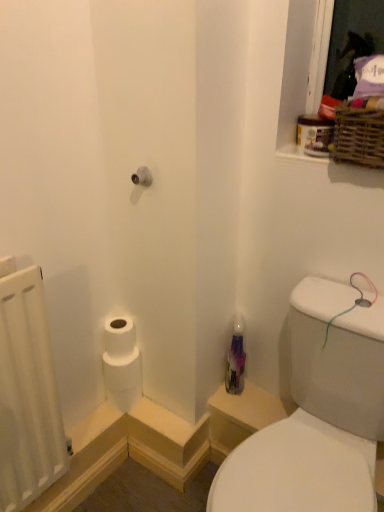
Where is `transparent plastic bottle at lower right`? Image resolution: width=384 pixels, height=512 pixels. transparent plastic bottle at lower right is located at coordinates (317, 415).

You are a GUI agent. You are given a task and a screenshot of the screen. Output one action in this format:
    pyautogui.click(x=<x>, y=<y>)
    Task: Click on the white matte radiator at left
    
    Given the screenshot: What is the action you would take?
    pyautogui.click(x=27, y=394)

Describe the element at coordinates (359, 134) in the screenshot. The image size is (384, 512). I see `woven brown basket at upper right` at that location.

This screenshot has width=384, height=512. Identify the location of transparent plastic bottle at lower right. (317, 415).

I want to click on radiator that is in front of the woven brown basket at upper right, so [x=27, y=394].

Does woven brown basket at upper right touch white matte radiator at left?

woven brown basket at upper right is not next to white matte radiator at left, and they're not touching.

Could you tell me if woven brown basket at upper right is facing white matte radiator at left?

No, woven brown basket at upper right is not turned towards white matte radiator at left.

From a real-world perspective, which object stands above the other?

woven brown basket at upper right, from a real-world perspective.

From the image's perspective, which one is positioned lower, woven brown basket at upper right or white matte toilet paper at lower left?

From the image's view, white matte toilet paper at lower left is below.

Is woven brown basket at upper right further to the viewer compared to white matte toilet paper at lower left?

No.

Which of these two, woven brown basket at upper right or white matte toilet paper at lower left, stands taller?

Standing taller between the two is white matte toilet paper at lower left.

Consider the image. Is woven brown basket at upper right spatially inside white matte toilet paper at lower left, or outside of it?

woven brown basket at upper right is spatially situated outside white matte toilet paper at lower left.

Which of these two, translucent purple bottle at center or white matte radiator at left, is bigger?

Bigger between the two is white matte radiator at left.

Between translucent purple bottle at center and white matte radiator at left, which one has less height?

translucent purple bottle at center is shorter.

Identify the location of toiletry on the right of white matte radiator at left. (236, 359).

Is white matte toilet paper at lower left further to camera compared to transparent plastic bottle at lower right?

Yes, white matte toilet paper at lower left is further from the viewer.

Is transparent plastic bottle at lower right completely or partially inside white matte toilet paper at lower left?

That's incorrect, transparent plastic bottle at lower right is not inside white matte toilet paper at lower left.

Between white matte toilet paper at lower left and transparent plastic bottle at lower right, which one appears on the right side from the viewer's perspective?

From the viewer's perspective, transparent plastic bottle at lower right appears more on the right side.

Is white matte toilet paper at lower left far away from transparent plastic bottle at lower right?

No.

Is transparent plastic bottle at lower right positioned far away from translucent purple bottle at center?

transparent plastic bottle at lower right is actually quite close to translucent purple bottle at center.

Is transparent plastic bottle at lower right situated inside translucent purple bottle at center or outside?

transparent plastic bottle at lower right is outside translucent purple bottle at center.

Is point (303, 294) more distant than point (231, 369)?

No, it is in front of (231, 369).

Locate an element on the screen. sink in front of the translucent purple bottle at center is located at coordinates (x=317, y=415).

Consider the image. Is transparent plastic bottle at lower right bigger than white matte toilet paper at lower left?

Indeed, transparent plastic bottle at lower right has a larger size compared to white matte toilet paper at lower left.

Does transparent plastic bottle at lower right have a lesser width compared to white matte toilet paper at lower left?

Incorrect, the width of transparent plastic bottle at lower right is not less than that of white matte toilet paper at lower left.

From the image's perspective, who appears lower, transparent plastic bottle at lower right or white matte toilet paper at lower left?

transparent plastic bottle at lower right.

What's the angular difference between white matte toilet paper at lower left and translucent purple bottle at center's facing directions?

The angular difference between white matte toilet paper at lower left and translucent purple bottle at center is 89.5 degrees.

How much distance is there between white matte toilet paper at lower left and translucent purple bottle at center?

white matte toilet paper at lower left and translucent purple bottle at center are 13.90 inches apart from each other.

Considering the positions of objects white matte toilet paper at lower left and translucent purple bottle at center in the image provided, who is behind, white matte toilet paper at lower left or translucent purple bottle at center?

white matte toilet paper at lower left is more distant.

From the image's perspective, is white matte toilet paper at lower left over translucent purple bottle at center?

Actually, white matte toilet paper at lower left appears below translucent purple bottle at center in the image.

Image resolution: width=384 pixels, height=512 pixels. I want to click on basket above the white matte radiator at left (from the image's perspective), so click(x=359, y=134).

The height and width of the screenshot is (512, 384). I want to click on toilet paper lying behind the woven brown basket at upper right, so click(x=123, y=379).

Considering their positions, is translucent purple bottle at center positioned closer to woven brown basket at upper right than transparent plastic bottle at lower right?

Among the two, transparent plastic bottle at lower right is located nearer to woven brown basket at upper right.

Estimate the real-world distances between objects in this image. Which object is further from white matte radiator at left, white matte toilet paper at lower left or woven brown basket at upper right?

woven brown basket at upper right lies further to white matte radiator at left than the other object.

Looking at the image, which one is located further to white matte radiator at left, woven brown basket at upper right or transparent plastic bottle at lower right?

woven brown basket at upper right is positioned further to the anchor white matte radiator at left.

From the image, which object appears to be farther from translucent purple bottle at center, white matte radiator at left or woven brown basket at upper right?

woven brown basket at upper right.

From the image, which object appears to be farther from white matte radiator at left, transparent plastic bottle at lower right or translucent purple bottle at center?

translucent purple bottle at center.

Considering their positions, is transparent plastic bottle at lower right positioned further to woven brown basket at upper right than white matte radiator at left?

white matte radiator at left lies further to woven brown basket at upper right than the other object.

Based on their spatial positions, is transparent plastic bottle at lower right or white matte toilet paper at lower left closer to translucent purple bottle at center?

Result: white matte toilet paper at lower left is closer to translucent purple bottle at center.

Which object lies nearer to the anchor point woven brown basket at upper right, transparent plastic bottle at lower right or translucent purple bottle at center?

transparent plastic bottle at lower right lies closer to woven brown basket at upper right than the other object.

I want to click on toiletry between woven brown basket at upper right and white matte toilet paper at lower left in the vertical direction, so click(x=236, y=359).

At what (x,y) coordinates should I click in order to perform the action: click on radiator between transparent plastic bottle at lower right and translucent purple bottle at center in the front-back direction. Please return your answer as a coordinate pair (x, y). The width and height of the screenshot is (384, 512). Looking at the image, I should click on (27, 394).

Locate an element on the screen. radiator located between transparent plastic bottle at lower right and white matte toilet paper at lower left in the depth direction is located at coordinates (27, 394).

Identify the location of sink situated between white matte radiator at left and woven brown basket at upper right from left to right. (317, 415).